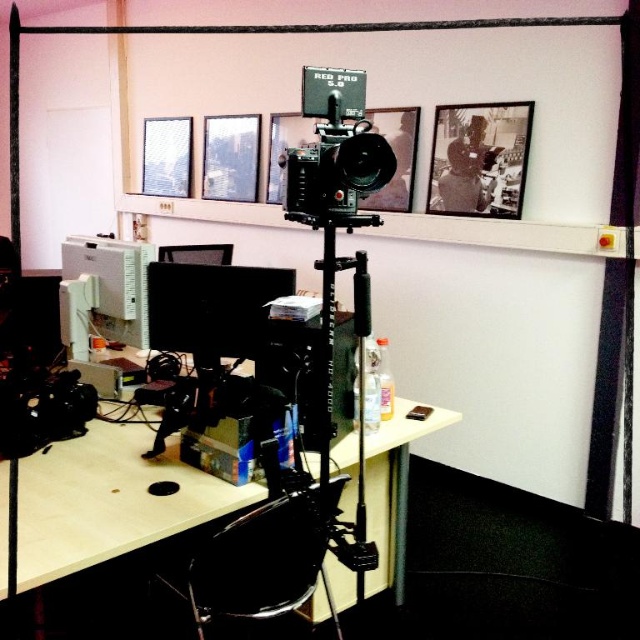
Can you confirm if metallic silver picture frame at upper center is positioned below metallic silver picture frame at upper left?

Yes, metallic silver picture frame at upper center is below metallic silver picture frame at upper left.

Where is `metallic silver picture frame at upper center`? The width and height of the screenshot is (640, 640). metallic silver picture frame at upper center is located at coordinates (x=230, y=157).

The image size is (640, 640). Describe the element at coordinates (108, 500) in the screenshot. I see `matte black desk at center` at that location.

Who is higher up, matte black desk at center or black plastic swivel chair at center?

matte black desk at center is higher up.

What do you see at coordinates (108, 500) in the screenshot? I see `matte black desk at center` at bounding box center [108, 500].

The width and height of the screenshot is (640, 640). What are the coordinates of `matte black desk at center` in the screenshot? It's located at (108, 500).

Can you confirm if metallic silver picture frame at upper center is shorter than black glossy picture frame at upper center?

In fact, metallic silver picture frame at upper center may be taller than black glossy picture frame at upper center.

Is metallic silver picture frame at upper center bigger than black glossy picture frame at upper center?

Yes, metallic silver picture frame at upper center is bigger than black glossy picture frame at upper center.

Is point (230, 193) closer to camera compared to point (376, 122)?

No.

Find the location of a particular element. metallic silver picture frame at upper center is located at coordinates (230, 157).